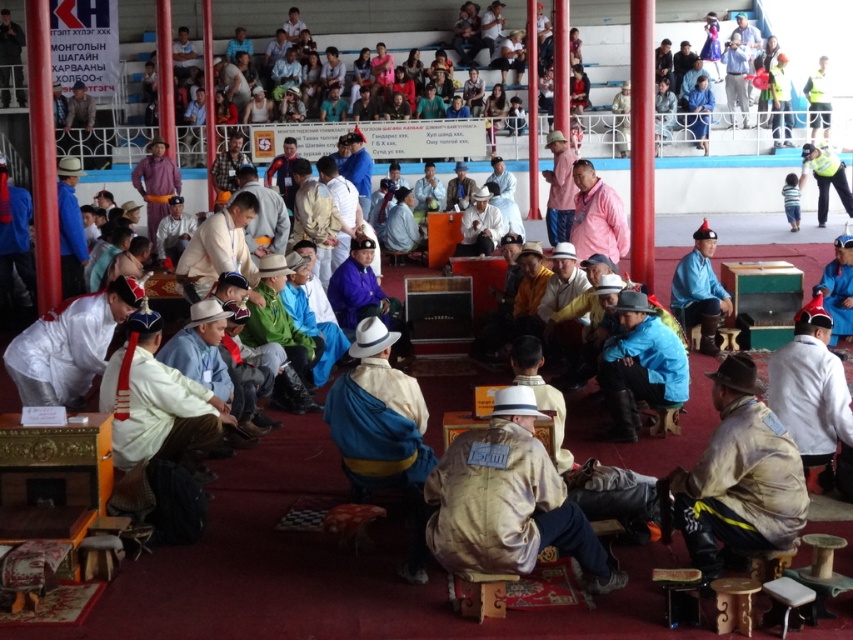
You are a photographer at the event and want to capture both the tan suede jacket at center and the camouflage fabric jacket at center in a single photo. However, you can only focus on one jacket at a time. Which jacket should you focus on to ensure the other is still visible in the background?

You should focus on the tan suede jacket at center since it is in front of the camouflage fabric jacket at center, allowing the latter to appear in the background.

You are a photographer at the event and need to capture a closeup shot of both the tan suede jacket at center and the camouflage fabric jacket at center. Which jacket should you zoom in on to ensure both are in frame without moving the camera?

The tan suede jacket at center is larger in size than the camouflage fabric jacket at center, so you should zoom in on the tan suede jacket at center to ensure both are in frame without moving the camera.